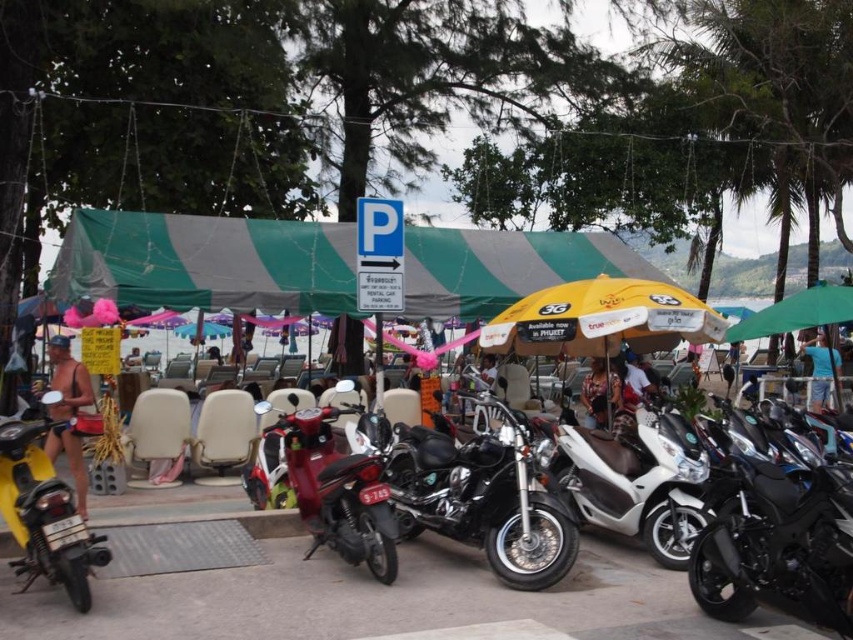
You are standing at the point marked by the coordinates point (635, 481) in the scene. What object are you standing on?

The point (635, 481) corresponds to the white matte scooter at center, so you are standing on the white matte scooter at center.

You are a photographer standing at the beach and need to decide whether to place your tripod behind the shiny chrome motorcycle at center or the leather jacket at center to capture both objects in the frame. Which object should you choose to place the tripod behind to ensure both are visible?

The shiny chrome motorcycle at center is much taller than the leather jacket at center, so placing the tripod behind the motorcycle will allow both objects to be visible in the frame without obstruction.

You are standing at the beach and see two points marked in the scene. Which point is closer to you, point (456, 442) or point (82, 461)?

Point (82, 461) is closer to you because it is less further to the viewer than point (456, 442).